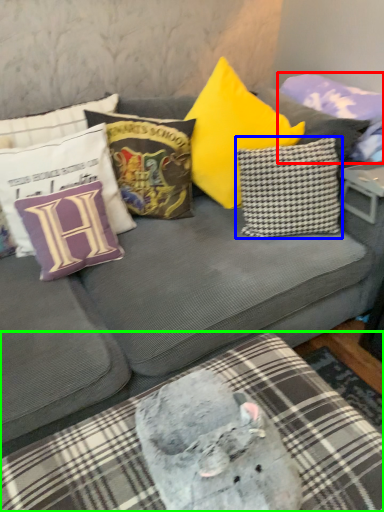
Question: Based on their relative distances, which object is nearer to pillow (highlighted by a red box)? Choose from pillow (highlighted by a blue box) and bedding (highlighted by a green box).

Choices:
 (A) pillow
 (B) bedding

Answer: (A)